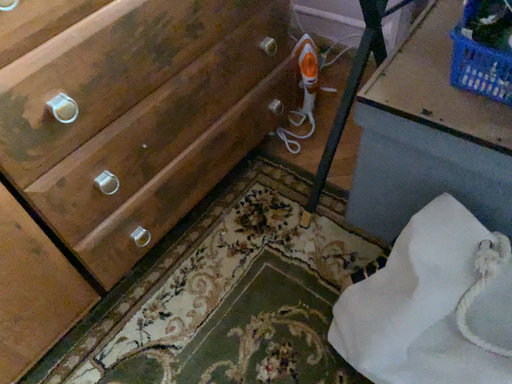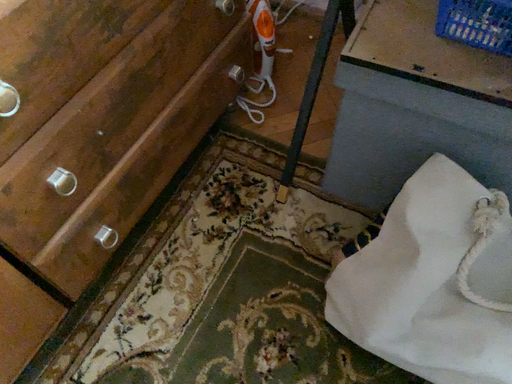
Question: Which way did the camera rotate in the video?

Choices:
 (A) rotated right
 (B) rotated left

Answer: (A)